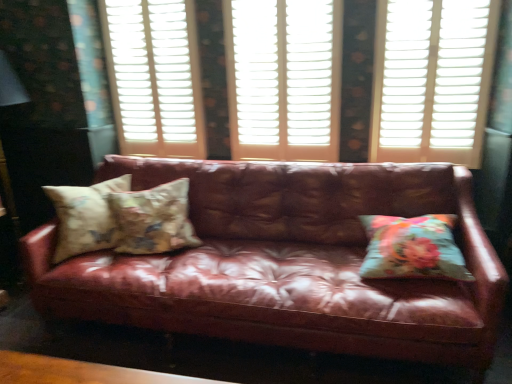
Question: Does white plastic shutters at center, acting as the 1th window frame starting from the left, have a greater height compared to white wood window frame at center, which ranks as the first window frame in right-to-left order?

Choices:
 (A) yes
 (B) no

Answer: (A)

Question: Is white plastic shutters at center, which ranks as the 2th window frame in right-to-left order, smaller than white wood window frame at center, the 2th window frame viewed from the left?

Choices:
 (A) yes
 (B) no

Answer: (A)

Question: Is white plastic shutters at center, which ranks as the 2th window frame in right-to-left order, to the right of white wood window frame at center, the 2th window frame viewed from the left, from the viewer's perspective?

Choices:
 (A) yes
 (B) no

Answer: (B)

Question: From a real-world perspective, is white plastic shutters at center, which ranks as the 2th window frame in right-to-left order, over white wood window frame at center, which ranks as the first window frame in right-to-left order?

Choices:
 (A) yes
 (B) no

Answer: (A)

Question: Does white plastic shutters at center, acting as the 1th window frame starting from the left, come in front of white wood window frame at center, which ranks as the first window frame in right-to-left order?

Choices:
 (A) no
 (B) yes

Answer: (A)

Question: Is floral fabric pillow at right, the third pillow in the left-to-right sequence, in front of or behind white wood window frame at center, the 2th window frame viewed from the left, in the image?

Choices:
 (A) front
 (B) behind

Answer: (A)

Question: Is floral fabric pillow at right, which ranks as the first pillow in right-to-left order, to the left or to the right of white wood window frame at center, which ranks as the first window frame in right-to-left order, in the image?

Choices:
 (A) right
 (B) left

Answer: (A)

Question: Is floral fabric pillow at right, the third pillow in the left-to-right sequence, spatially inside white wood window frame at center, the 2th window frame viewed from the left, or outside of it?

Choices:
 (A) outside
 (B) inside

Answer: (A)

Question: Considering the positions of floral fabric pillow at right, the third pillow in the left-to-right sequence, and white wood window frame at center, which ranks as the first window frame in right-to-left order, in the image, is floral fabric pillow at right, the third pillow in the left-to-right sequence, bigger or smaller than white wood window frame at center, which ranks as the first window frame in right-to-left order,?

Choices:
 (A) small
 (B) big

Answer: (A)

Question: In terms of width, does white plastic shutters at upper center look wider or thinner when compared to floral fabric pillow at right, which ranks as the first pillow in right-to-left order?

Choices:
 (A) thin
 (B) wide

Answer: (A)

Question: Considering the positions of white plastic shutters at upper center and floral fabric pillow at right, which ranks as the first pillow in right-to-left order, in the image, is white plastic shutters at upper center taller or shorter than floral fabric pillow at right, which ranks as the first pillow in right-to-left order,?

Choices:
 (A) short
 (B) tall

Answer: (B)

Question: From a real-world perspective, relative to floral fabric pillow at right, which ranks as the first pillow in right-to-left order, is white plastic shutters at upper center vertically above or below?

Choices:
 (A) below
 (B) above

Answer: (B)

Question: Which is correct: white plastic shutters at upper center is inside floral fabric pillow at right, the third pillow in the left-to-right sequence, or outside of it?

Choices:
 (A) outside
 (B) inside

Answer: (A)

Question: In the image, is white plastic shutters at center, which ranks as the 2th window frame in right-to-left order, on the left side or the right side of leather couch at center?

Choices:
 (A) right
 (B) left

Answer: (B)

Question: From a real-world perspective, is white plastic shutters at center, acting as the 1th window frame starting from the left, positioned above or below leather couch at center?

Choices:
 (A) above
 (B) below

Answer: (A)